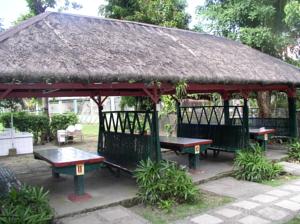
What are the coordinates of `tables` in the screenshot? It's located at (72, 159), (184, 143), (263, 133).